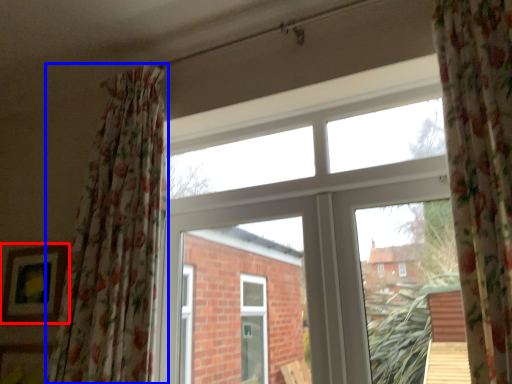
Question: Which object appears closest to the camera in this image, picture frame (highlighted by a red box) or curtain (highlighted by a blue box)?

Choices:
 (A) picture frame
 (B) curtain

Answer: (B)